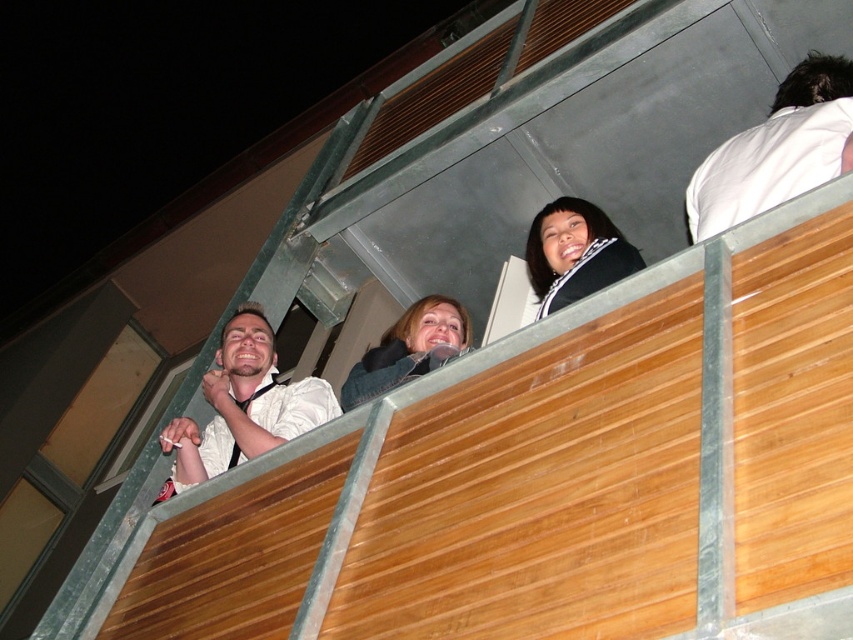
The image size is (853, 640). Identify the location of white matte shirt at upper right. (776, 148).

Is white matte shirt at upper right below black satin scarf at upper center?

Incorrect, white matte shirt at upper right is not positioned below black satin scarf at upper center.

This screenshot has width=853, height=640. Find the location of `white matte shirt at upper right`. white matte shirt at upper right is located at coordinates (776, 148).

Does white matte shirt at upper right appear over white matte shirt at left?

Yes.

At what (x,y) coordinates should I click in order to perform the action: click on white matte shirt at upper right. Please return your answer as a coordinate pair (x, y). Image resolution: width=853 pixels, height=640 pixels. Looking at the image, I should click on (776, 148).

Which is more to the right, black satin scarf at upper center or matte blue jacket at center?

black satin scarf at upper center

Does black satin scarf at upper center have a greater width compared to matte blue jacket at center?

In fact, black satin scarf at upper center might be narrower than matte blue jacket at center.

What do you see at coordinates (575, 252) in the screenshot? I see `black satin scarf at upper center` at bounding box center [575, 252].

Image resolution: width=853 pixels, height=640 pixels. In order to click on black satin scarf at upper center in this screenshot , I will do `click(575, 252)`.